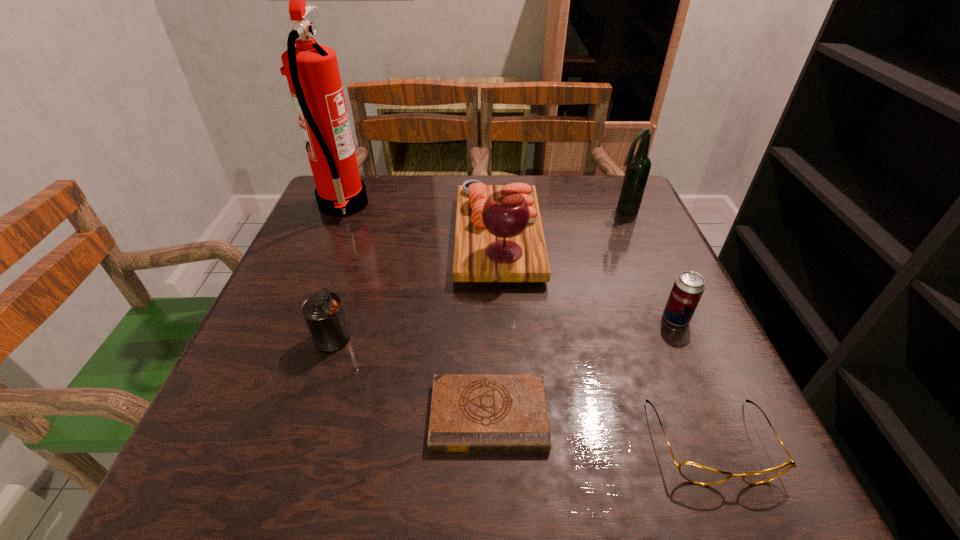
Locate an element on the screen. beer bottle situated at the right edge is located at coordinates (638, 167).

This screenshot has width=960, height=540. In order to click on beer can located in the right edge section of the desktop in this screenshot , I will do `click(688, 288)`.

At what (x,y) coordinates should I click in order to perform the action: click on spectacles that is at the right edge. Please return your answer as a coordinate pair (x, y). Looking at the image, I should click on [693, 472].

At what (x,y) coordinates should I click in order to perform the action: click on object present at the far left corner. Please return your answer as a coordinate pair (x, y). Looking at the image, I should click on (312, 72).

The height and width of the screenshot is (540, 960). Find the location of `object at the far right corner`. object at the far right corner is located at coordinates (638, 167).

The height and width of the screenshot is (540, 960). What are the coordinates of `object at the near right corner` in the screenshot? It's located at (693, 472).

Image resolution: width=960 pixels, height=540 pixels. I want to click on vacant space at the far edge, so click(551, 200).

At what (x,y) coordinates should I click in order to perform the action: click on free region at the near edge of the desktop. Please return your answer as a coordinate pair (x, y). The height and width of the screenshot is (540, 960). Looking at the image, I should click on (299, 485).

This screenshot has width=960, height=540. In order to click on vacant space at the left edge of the desktop in this screenshot , I will do pos(299,331).

You are a GUI agent. You are given a task and a screenshot of the screen. Output one action in this format:
    pyautogui.click(x=<x>, y=<y>)
    Task: Click on the vacant space at the right edge
    This screenshot has height=540, width=960.
    Given the screenshot: What is the action you would take?
    pyautogui.click(x=653, y=272)